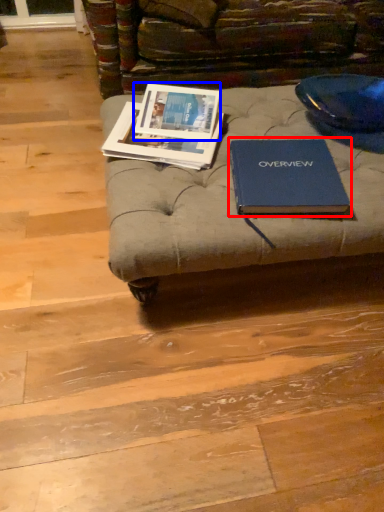
Question: Which object appears closest to the camera in this image, book (highlighted by a red box) or book cover (highlighted by a blue box)?

Choices:
 (A) book
 (B) book cover

Answer: (A)